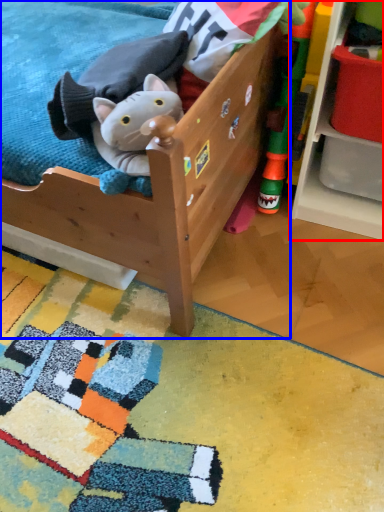
Question: Which object appears closest to the camera in this image, shelf (highlighted by a red box) or furniture (highlighted by a blue box)?

Choices:
 (A) shelf
 (B) furniture

Answer: (B)